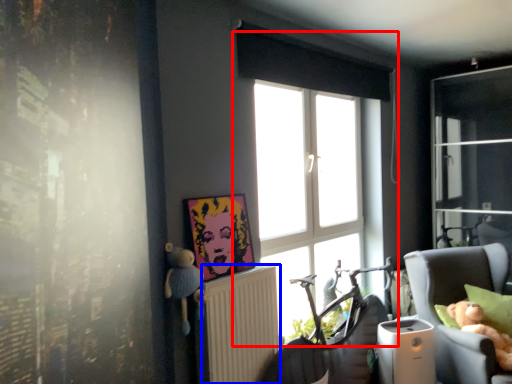
Question: Among these objects, which one is farthest to the camera, window (highlighted by a red box) or radiator (highlighted by a blue box)?

Choices:
 (A) window
 (B) radiator

Answer: (A)